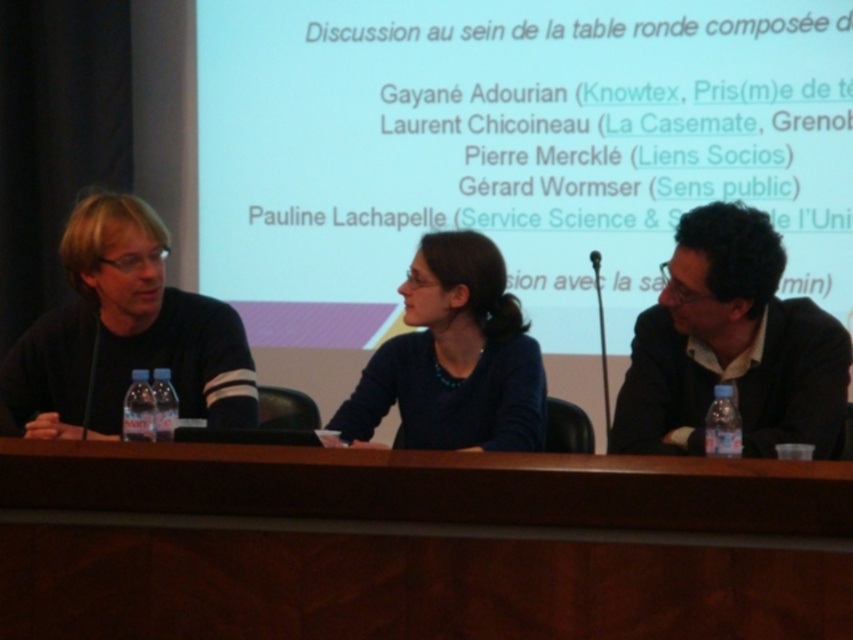
Question: Does white matte projection screen at upper center have a larger size compared to black matte shirt at left?

Choices:
 (A) yes
 (B) no

Answer: (A)

Question: Which of these objects is positioned farthest from the black matte shirt at left?

Choices:
 (A) dark brown leather jacket at right
 (B) brown wood table at center
 (C) matte blue sweater at center

Answer: (A)

Question: Estimate the real-world distances between objects in this image. Which object is farther from the matte blue sweater at center?

Choices:
 (A) brown wood table at center
 (B) dark brown leather jacket at right
 (C) white matte projection screen at upper center

Answer: (C)

Question: Does white matte projection screen at upper center appear on the right side of black matte shirt at left?

Choices:
 (A) yes
 (B) no

Answer: (A)

Question: Does dark brown leather jacket at right have a larger size compared to matte blue sweater at center?

Choices:
 (A) no
 (B) yes

Answer: (B)

Question: Which object appears closest to the camera in this image?

Choices:
 (A) matte blue sweater at center
 (B) white matte projection screen at upper center
 (C) black matte shirt at left

Answer: (C)